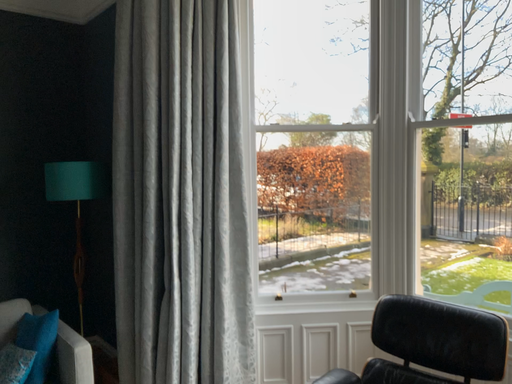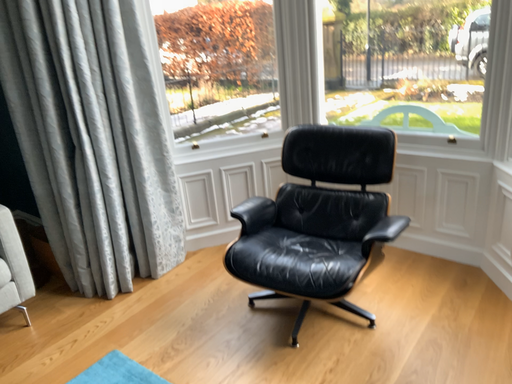
Question: How did the camera likely rotate when shooting the video?

Choices:
 (A) rotated upward
 (B) rotated downward

Answer: (B)